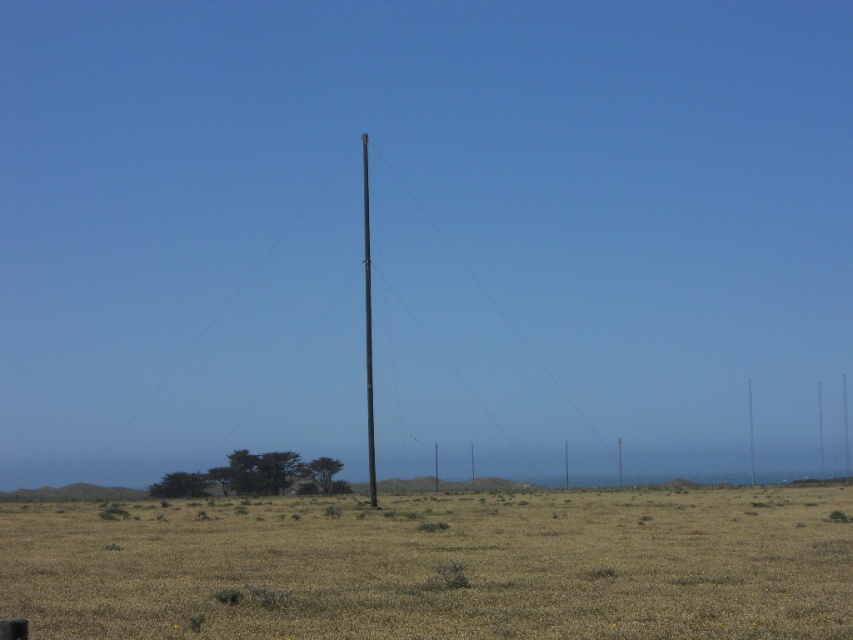
Between brown grassland at center and black smooth telegraph pole at center, which one appears on the left side from the viewer's perspective?

black smooth telegraph pole at center

Who is more forward, (x=509, y=582) or (x=367, y=369)?

Point (x=509, y=582)

The height and width of the screenshot is (640, 853). What are the coordinates of `brown grassland at center` in the screenshot? It's located at (439, 566).

Between point (601, 436) and point (364, 284), which one is positioned behind?

The point (601, 436) is more distant.

Where is `black metallic pole at center`? This screenshot has height=640, width=853. black metallic pole at center is located at coordinates (490, 298).

Does brown grassland at center appear over black metallic pole at center?

No.

Does point (695, 628) lie behind point (596, 435)?

No, (695, 628) is in front of (596, 435).

Identify the location of brown grassland at center. (439, 566).